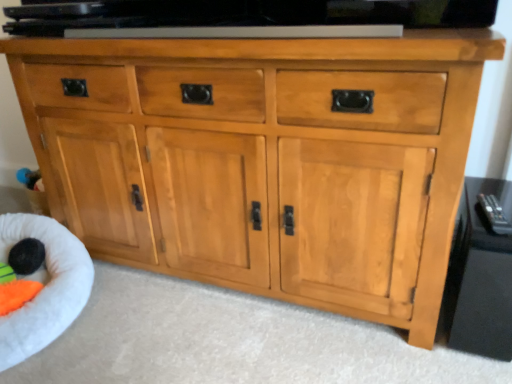
Question: From their relative heights in the image, would you say black fuzzy ball at lower left is taller or shorter than white plush infant bed at lower left?

Choices:
 (A) short
 (B) tall

Answer: (A)

Question: Considering the positions of black fuzzy ball at lower left and white plush infant bed at lower left in the image, is black fuzzy ball at lower left wider or thinner than white plush infant bed at lower left?

Choices:
 (A) wide
 (B) thin

Answer: (B)

Question: Which is nearer to the white plush infant bed at lower left?

Choices:
 (A) black fuzzy ball at lower left
 (B) glossy black tv stand at right

Answer: (A)

Question: Which of these objects is positioned closest to the glossy black tv stand at right?

Choices:
 (A) white plush infant bed at lower left
 (B) black fuzzy ball at lower left

Answer: (A)